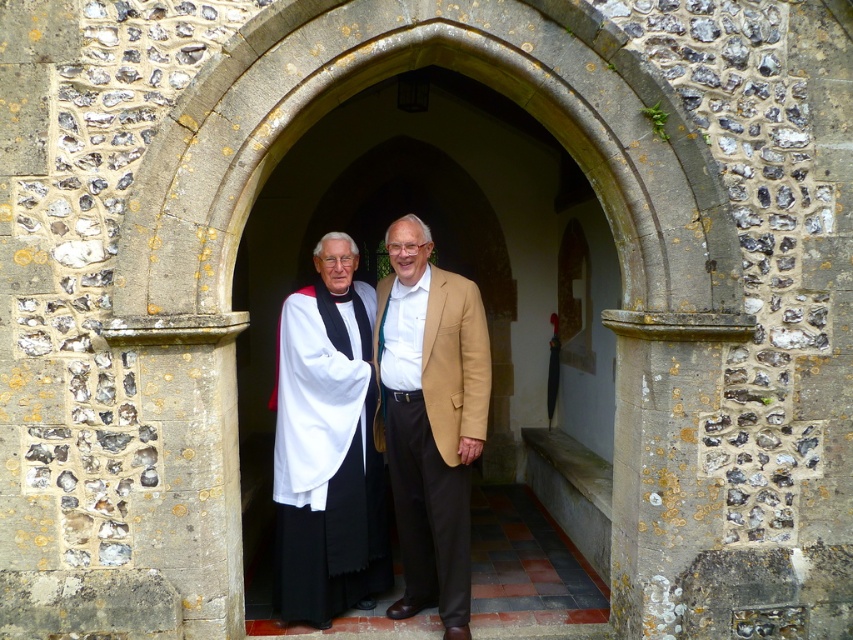
At what (x,y) coordinates should I click in order to perform the action: click on matte white robe at center. Please return your answer as a coordinate pair (x, y). Looking at the image, I should click on (434, 436).

Which is above, matte white robe at center or white matte/soft fabric robe at center?

Positioned higher is matte white robe at center.

Who is more distant from viewer, [426,352] or [328,412]?

Point [328,412]

The width and height of the screenshot is (853, 640). Identify the location of matte white robe at center. (434, 436).

Where is `white cloth at center`? white cloth at center is located at coordinates (376, 432).

Between white cloth at center and matte white robe at center, which one is positioned lower?

Positioned lower is matte white robe at center.

What do you see at coordinates (376, 432) in the screenshot?
I see `white cloth at center` at bounding box center [376, 432].

Does point (421, 392) come in front of point (383, 333)?

Yes, point (421, 392) is in front of point (383, 333).

Locate an element on the screen. Image resolution: width=853 pixels, height=640 pixels. white cloth at center is located at coordinates (376, 432).